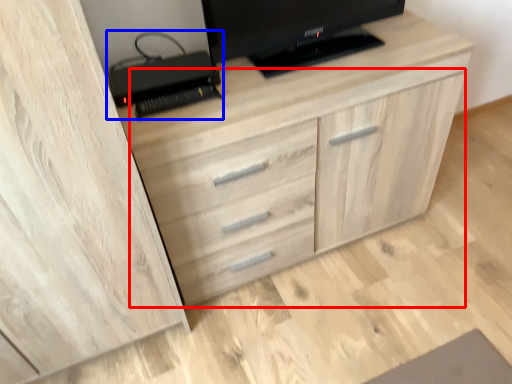
Question: Which point is closer to the camera, dresser (highlighted by a red box) or computer (highlighted by a blue box)?

Choices:
 (A) dresser
 (B) computer

Answer: (A)